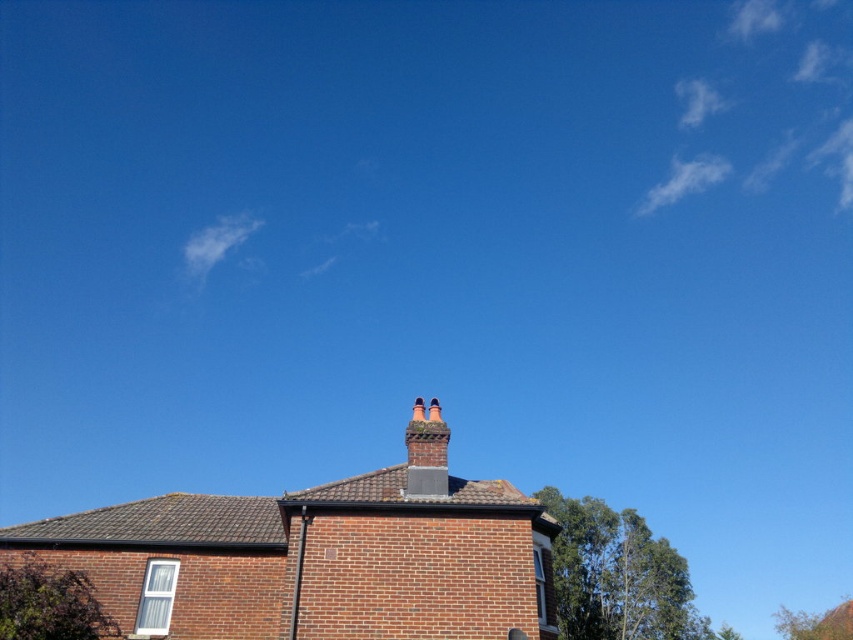
Question: Is red brick chimney at center bigger than green leafy tree at lower right?

Choices:
 (A) no
 (B) yes

Answer: (A)

Question: Does green leafy tree at lower left have a lesser width compared to red brick chimney at center?

Choices:
 (A) yes
 (B) no

Answer: (B)

Question: Can you confirm if green leafy tree at lower left is wider than green leafy tree at lower right?

Choices:
 (A) no
 (B) yes

Answer: (A)

Question: Which object is the farthest from the green leafy tree at lower right?

Choices:
 (A) green leafy tree at lower left
 (B) green leafy tree at upper right
 (C) red brick chimney at center

Answer: (C)

Question: Which of the following is the farthest from the observer?

Choices:
 (A) (688, 624)
 (B) (788, 634)

Answer: (B)

Question: Which point is farther to the camera?

Choices:
 (A) (593, 593)
 (B) (90, 637)
 (C) (808, 636)

Answer: (C)